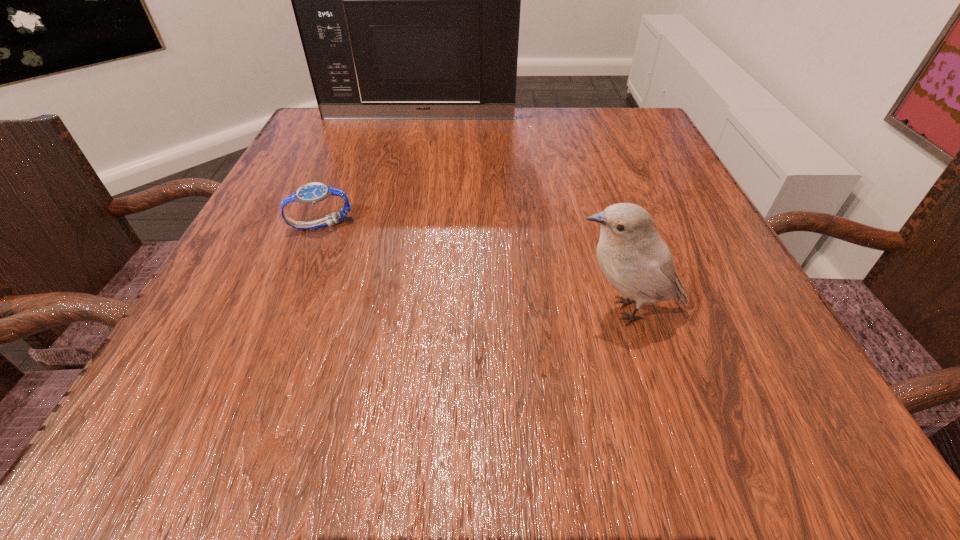
Find the location of a particular element. free spot located 0.350m on the right of the watch is located at coordinates (558, 225).

The height and width of the screenshot is (540, 960). Identify the location of object at the far edge. (407, 0).

The height and width of the screenshot is (540, 960). Identify the location of microwave oven that is at the left edge. (407, 0).

Locate an element on the screen. Image resolution: width=960 pixels, height=540 pixels. watch that is at the left edge is located at coordinates (311, 193).

Locate an element on the screen. object at the right edge is located at coordinates (637, 262).

Locate an element on the screen. The width and height of the screenshot is (960, 540). object that is at the far left corner is located at coordinates (407, 0).

You are a GUI agent. You are given a task and a screenshot of the screen. Output one action in this format:
    pyautogui.click(x=<x>, y=<y>)
    Task: Click on the free spot at the far edge of the desktop
    Image resolution: width=960 pixels, height=540 pixels.
    Given the screenshot: What is the action you would take?
    pyautogui.click(x=516, y=152)

The width and height of the screenshot is (960, 540). In order to click on vacant space at the near edge in this screenshot , I will do `click(642, 421)`.

Identify the location of vacant region at the left edge of the desktop. (278, 349).

In the image, there is a desktop. What are the coordinates of `vacant space at the right edge` in the screenshot? It's located at (635, 165).